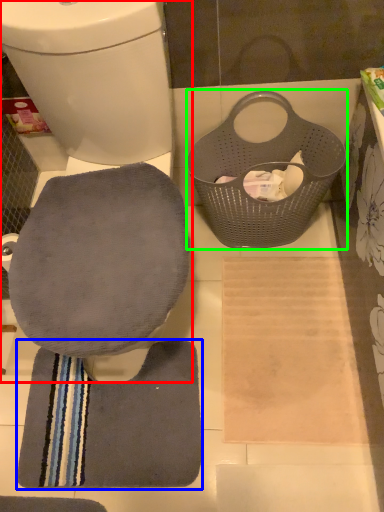
Question: Based on their relative distances, which object is farther from toilet (highlighted by a red box)? Choose from bath towel (highlighted by a blue box) and laundry basket (highlighted by a green box).

Choices:
 (A) bath towel
 (B) laundry basket

Answer: (A)